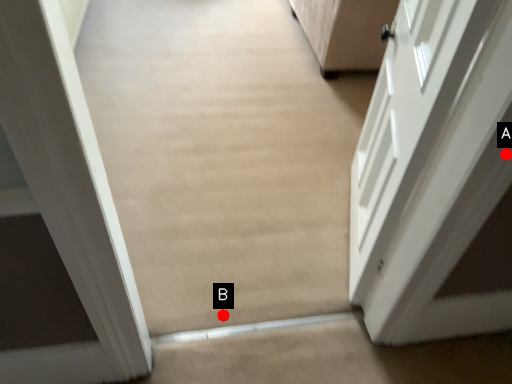
Question: Two points are circled on the image, labeled by A and B beside each circle. Which point is farther from the camera taking this photo?

Choices:
 (A) A is further
 (B) B is further

Answer: (B)